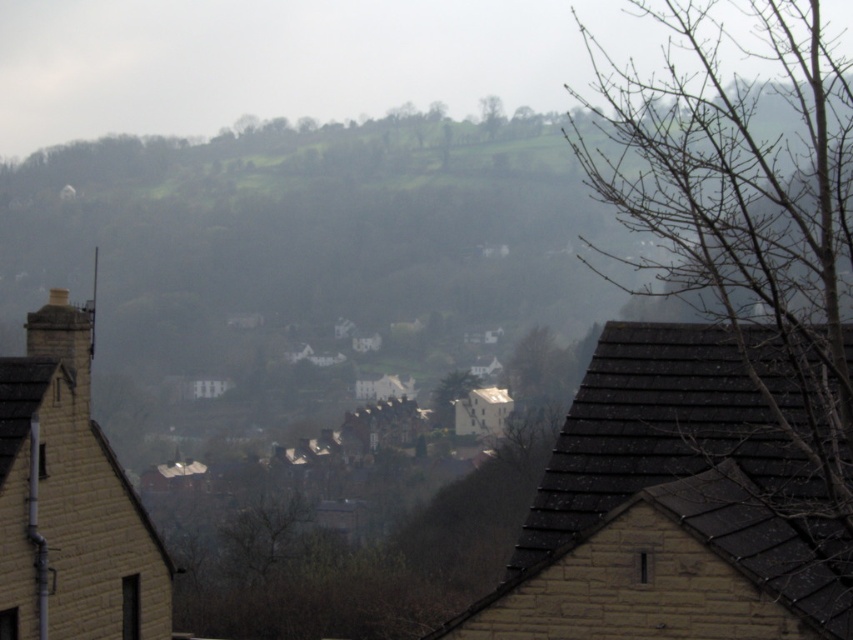
Question: Which point appears farthest from the camera in this image?

Choices:
 (A) (741, 362)
 (B) (500, 115)

Answer: (B)

Question: Does bare branches at upper right appear on the left side of green leafy tree at upper center?

Choices:
 (A) no
 (B) yes

Answer: (A)

Question: Considering the relative positions of bare branches at upper right and green leafy tree at upper center in the image provided, where is bare branches at upper right located with respect to green leafy tree at upper center?

Choices:
 (A) right
 (B) left

Answer: (A)

Question: Does bare branches at upper right appear over green leafy tree at upper center?

Choices:
 (A) no
 (B) yes

Answer: (A)

Question: Which of the following is the farthest from the observer?

Choices:
 (A) bare branches at upper right
 (B) green leafy tree at upper center

Answer: (B)

Question: Which point is farther to the camera?

Choices:
 (A) (601, 164)
 (B) (491, 116)

Answer: (B)